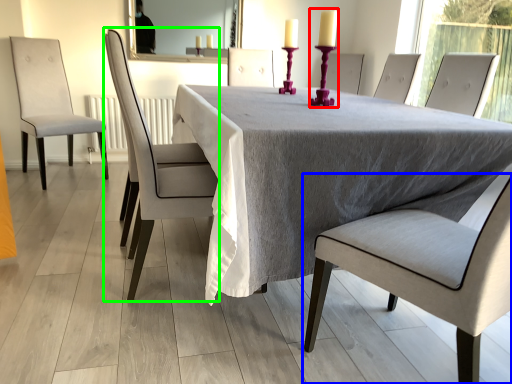
Question: Considering the real-world distances, which object is farthest from candle holder (highlighted by a red box)? chair (highlighted by a blue box) or chair (highlighted by a green box)?

Choices:
 (A) chair
 (B) chair

Answer: (A)